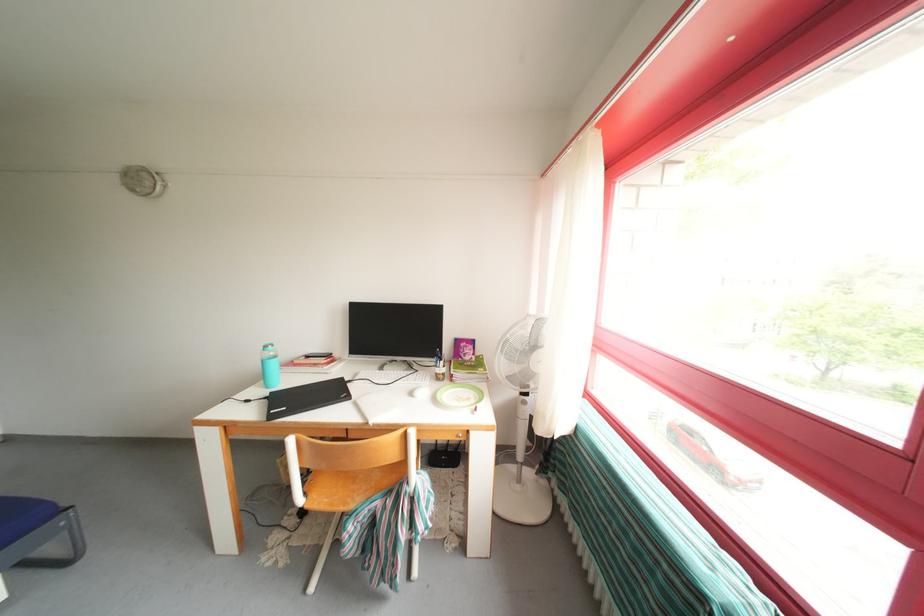
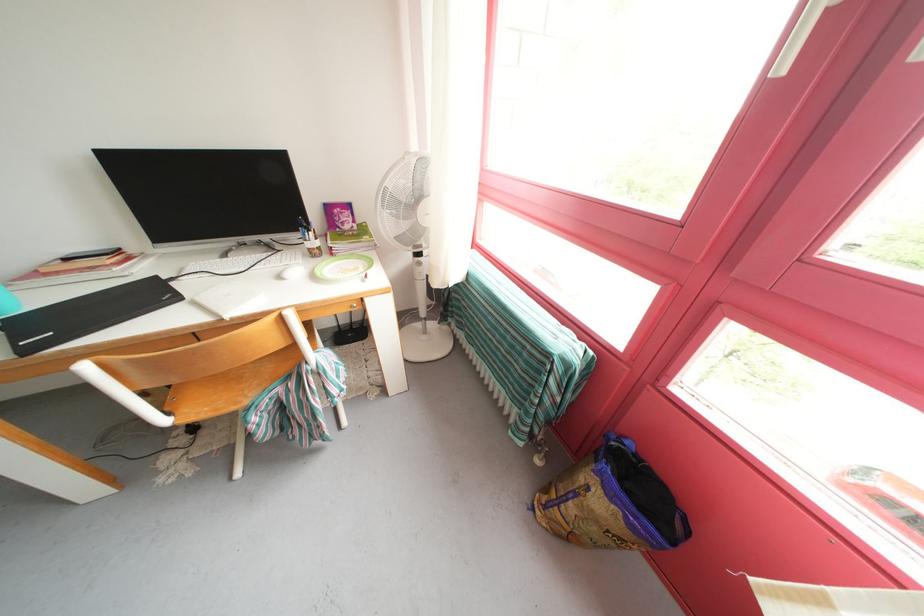
Where in the second image is the point corresponding to (482,392) from the first image?

(369, 262)